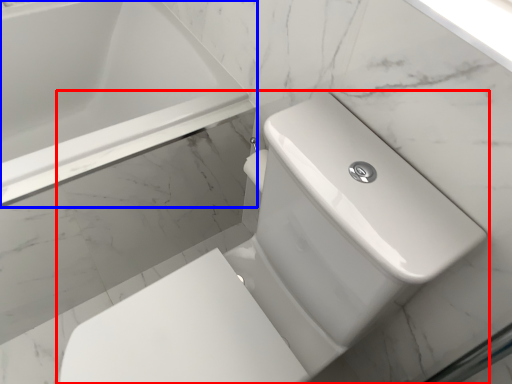
Question: Which point is further to the camera, toilet (highlighted by a red box) or bathtub (highlighted by a blue box)?

Choices:
 (A) toilet
 (B) bathtub

Answer: (B)